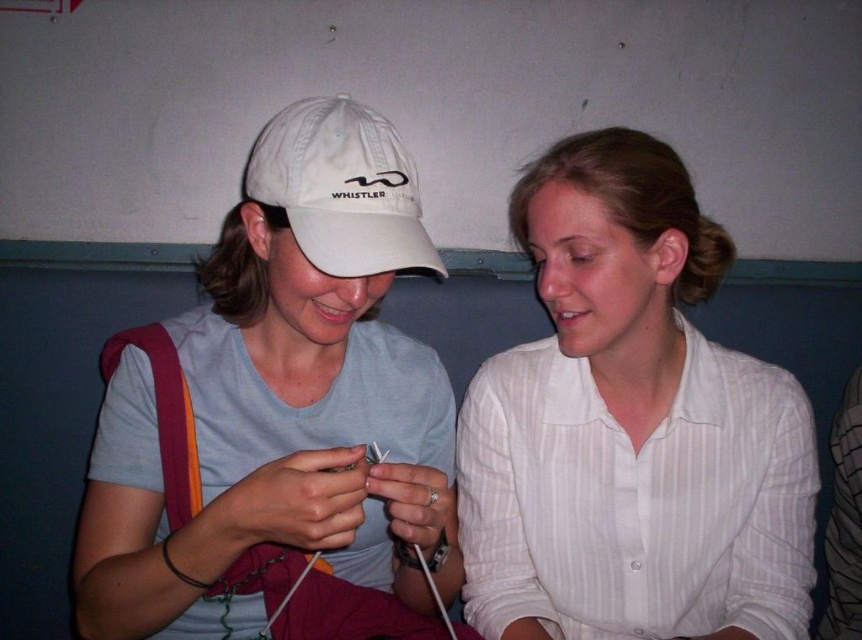
You are a fashion designer observing two people in the image. You need to determine which item is narrower between the white cotton cap at upper left and the white striped shirt at center. Which one is narrower?

The white cotton cap at upper left is thinner than the white striped shirt at center, so the white cotton cap at upper left is narrower.

You are a fashion designer observing two people in the image. You need to determine which item has a larger size between the white cotton cap at upper left and the white striped shirt at center. Which one is bigger?

The white cotton cap at upper left has a larger size compared to the white striped shirt at center, so the white cotton cap at upper left is bigger.